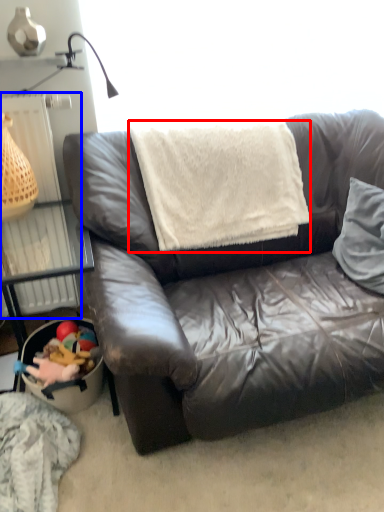
Question: Which of the following is the farthest to the observer, blanket (highlighted by a red box) or radiator (highlighted by a blue box)?

Choices:
 (A) blanket
 (B) radiator

Answer: (B)